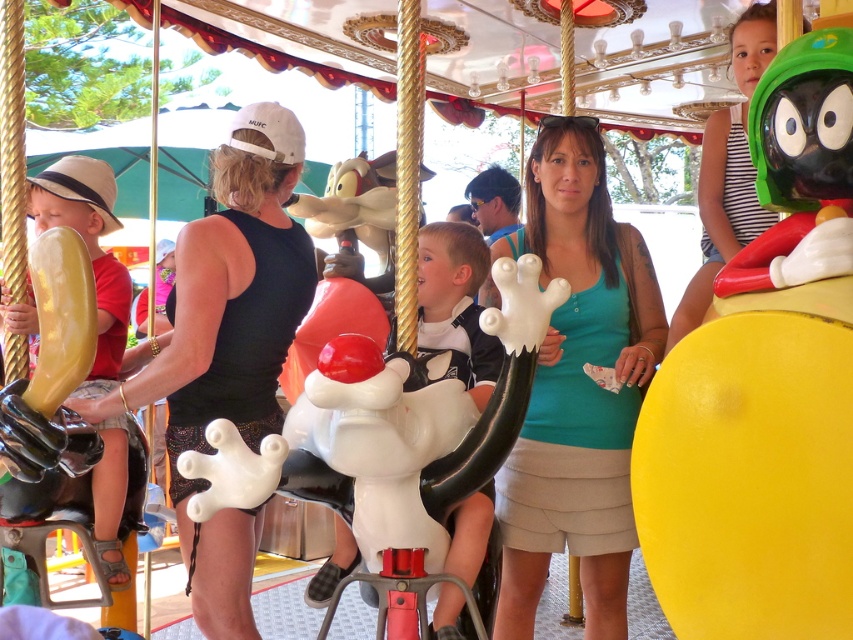
Question: Which object is positioned farthest from the green fabric shirt at center?

Choices:
 (A) black matte tank top at center
 (B) green matte plush toy at upper right
 (C) shiny plastic marvin at upper right
 (D) yellow matte balloon at left

Answer: (D)

Question: Among these points, which one is farthest from the camera?

Choices:
 (A) (804, 173)
 (B) (100, 477)

Answer: (B)

Question: Can you confirm if green fabric shirt at center is wider than black matte tank top at center?

Choices:
 (A) yes
 (B) no

Answer: (B)

Question: Does shiny plastic marvin at upper right appear under yellow matte balloon at left?

Choices:
 (A) yes
 (B) no

Answer: (B)

Question: Which point is farther to the camera?

Choices:
 (A) (792, 552)
 (B) (791, 84)
 (C) (67, 195)
 (D) (216, 310)

Answer: (C)

Question: In this image, where is shiny plastic marvin at upper right located relative to green fabric shirt at center?

Choices:
 (A) above
 (B) below

Answer: (A)